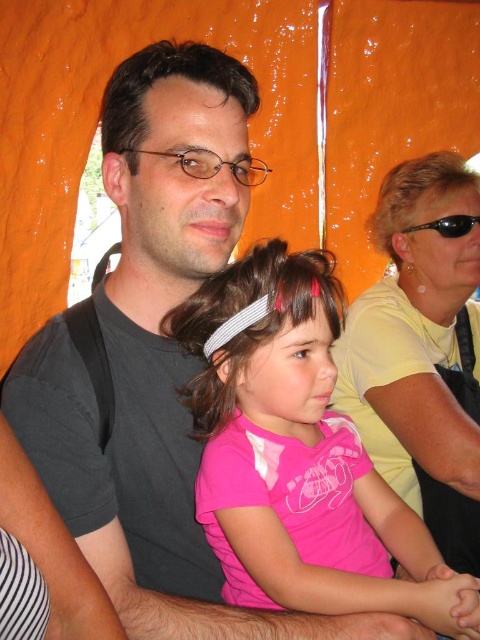
Who is higher up, pink fabric shirt at center or black plastic goggles at upper right?

black plastic goggles at upper right is above.

Does pink fabric shirt at center have a smaller size compared to black plastic goggles at upper right?

Incorrect, pink fabric shirt at center is not smaller in size than black plastic goggles at upper right.

Who is more distant from viewer, (310,378) or (462,227)?

The point (462,227) is more distant.

I want to click on pink fabric shirt at center, so click(x=303, y=449).